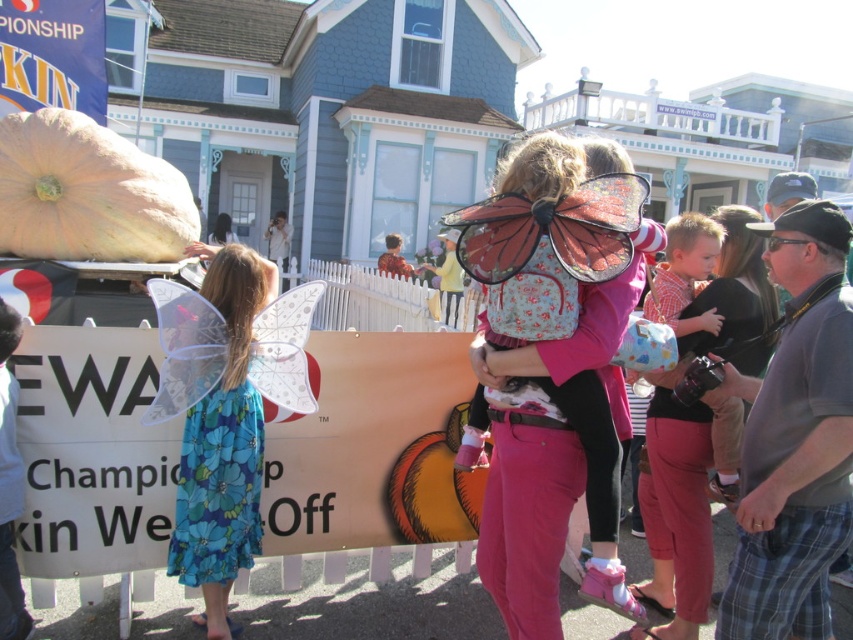
Question: Estimate the real-world distances between objects in this image. Which object is farther from the pink fabric wings at center?

Choices:
 (A) matte pink pants at center
 (B) blue floral dress at left

Answer: (B)

Question: Is matte pink pants at center thinner than blue floral dress at left?

Choices:
 (A) no
 (B) yes

Answer: (A)

Question: Which point appears closest to the camera in this image?

Choices:
 (A) (607, 372)
 (B) (180, 488)

Answer: (A)

Question: Observing the image, what is the correct spatial positioning of pink fabric wings at center in reference to blue floral dress at left?

Choices:
 (A) right
 (B) left

Answer: (A)

Question: Considering the relative positions of pink fabric wings at center and blue floral dress at left in the image provided, where is pink fabric wings at center located with respect to blue floral dress at left?

Choices:
 (A) below
 (B) above

Answer: (B)

Question: Among these points, which one is farthest from the camera?

Choices:
 (A) (682, 528)
 (B) (254, 532)
 (C) (576, 156)

Answer: (A)